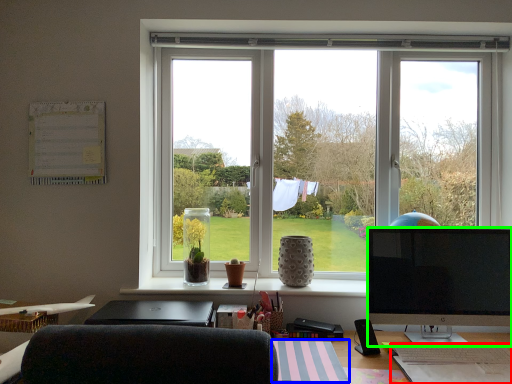
Question: Which object is positioned closest to wide (highlighted by a red box)? Select from notepad (highlighted by a blue box) and television (highlighted by a green box).

Choices:
 (A) notepad
 (B) television

Answer: (B)